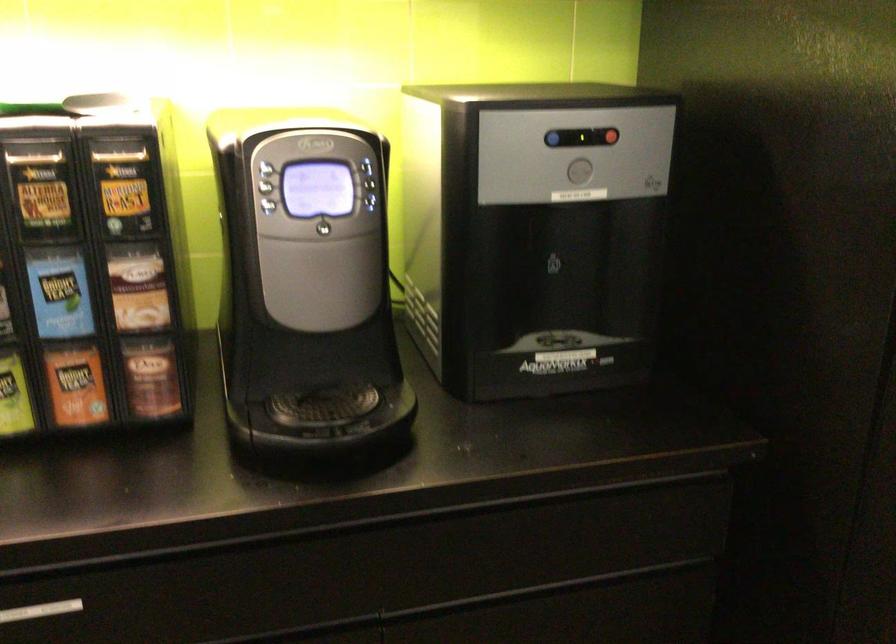
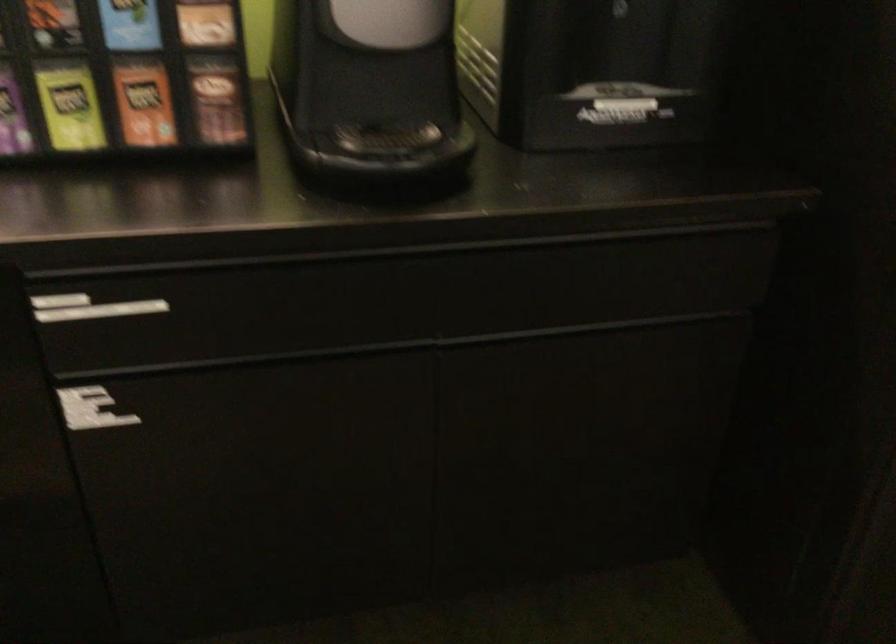
Question: Based on the continuous images, in which direction is the camera rotating? Reply with the corresponding letter.

Choices:
 (A) Left
 (B) Right
 (C) Up
 (D) Down

Answer: (D)